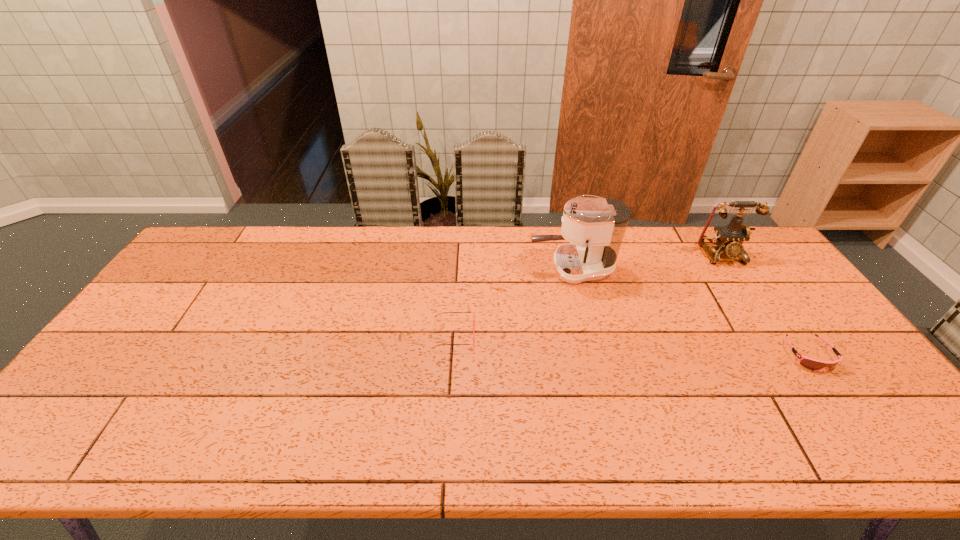
Locate an element on the screen. The width and height of the screenshot is (960, 540). empty space that is in between the telephone and the tallest object is located at coordinates (646, 261).

I want to click on unoccupied position between the goggles and the coffee maker, so click(691, 312).

Find the location of a particular element. This screenshot has width=960, height=540. free point between the tallest object and the third shortest object is located at coordinates (646, 261).

Identify the location of free space between the telephone and the second object from left to right. The width and height of the screenshot is (960, 540). (646, 261).

At what (x,y) coordinates should I click in order to perform the action: click on free spot between the spectacles and the shortest object. Please return your answer as a coordinate pair (x, y). Looking at the image, I should click on (632, 345).

Where is `empty space between the coffee maker and the third shortest object`? The width and height of the screenshot is (960, 540). empty space between the coffee maker and the third shortest object is located at coordinates (646, 261).

This screenshot has width=960, height=540. In order to click on free space between the second object from left to right and the goggles in this screenshot , I will do `click(691, 312)`.

Locate an element on the screen. unoccupied position between the goggles and the second tallest object is located at coordinates (765, 305).

Find the location of a particular element. This screenshot has width=960, height=540. empty location between the telephone and the shortest object is located at coordinates (765, 305).

At what (x,y) coordinates should I click in order to perform the action: click on vacant area that lies between the shortest object and the leftmost object. Please return your answer as a coordinate pair (x, y). The height and width of the screenshot is (540, 960). Looking at the image, I should click on (632, 345).